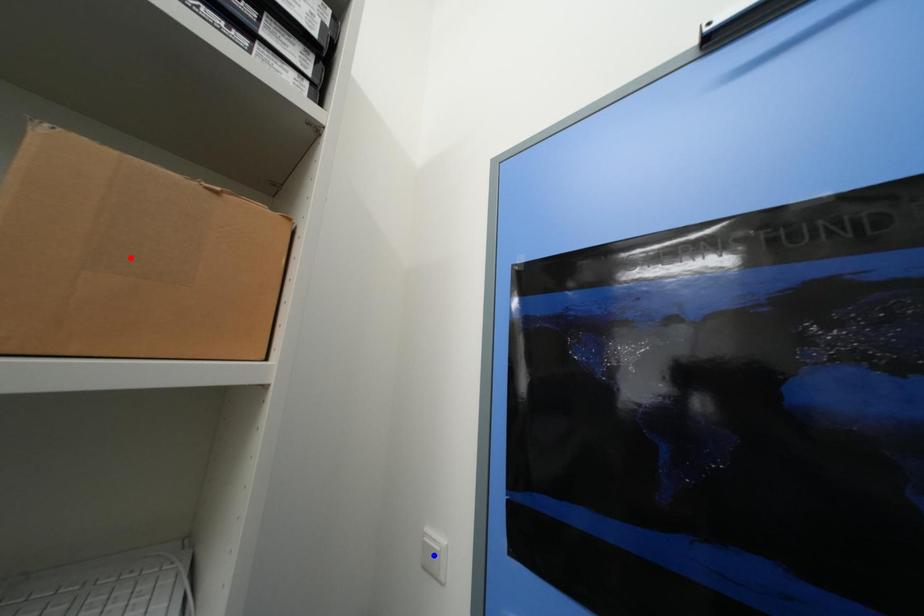
Question: In the image, two points are highlighted. Which point is nearer to the camera? Reply with the corresponding letter.

Choices:
 (A) blue point
 (B) red point

Answer: (B)